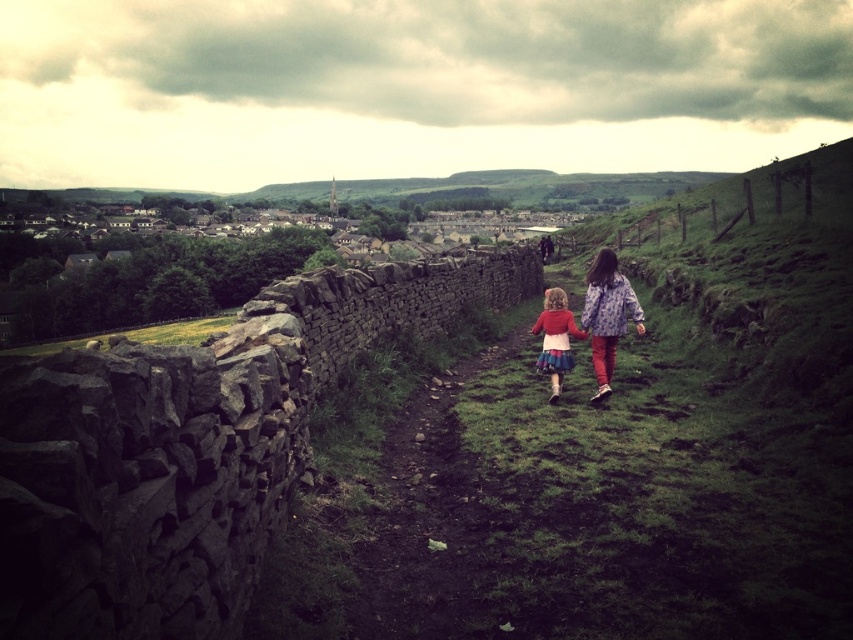
Between point (596, 330) and point (561, 371), which one is positioned in front?

Point (596, 330) is in front.

Does floral fabric jacket at right lie in front of matte red sweater at center?

Yes, floral fabric jacket at right is closer to the viewer.

Which is in front, point (595, 308) or point (583, 332)?

Point (595, 308)

Locate an element on the screen. floral fabric jacket at right is located at coordinates (607, 316).